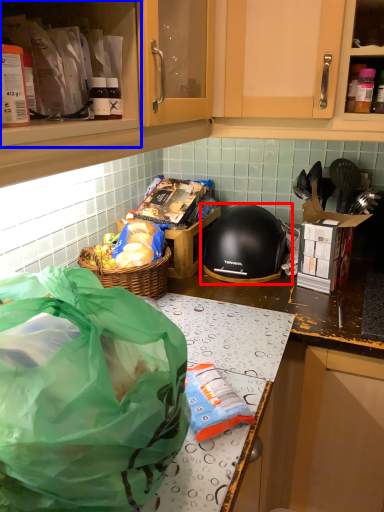
Question: Which of the following is the farthest to the observer, helmet (highlighted by a red box) or cabinetry (highlighted by a blue box)?

Choices:
 (A) helmet
 (B) cabinetry

Answer: (A)